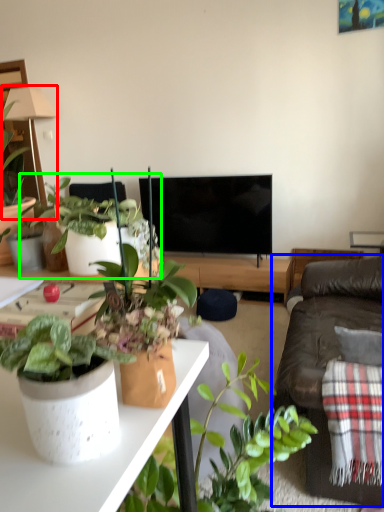
Question: Which object is positioned closest to lamp (highlighted by a red box)? Select from studio couch (highlighted by a blue box) and houseplant (highlighted by a green box).

Choices:
 (A) studio couch
 (B) houseplant

Answer: (B)